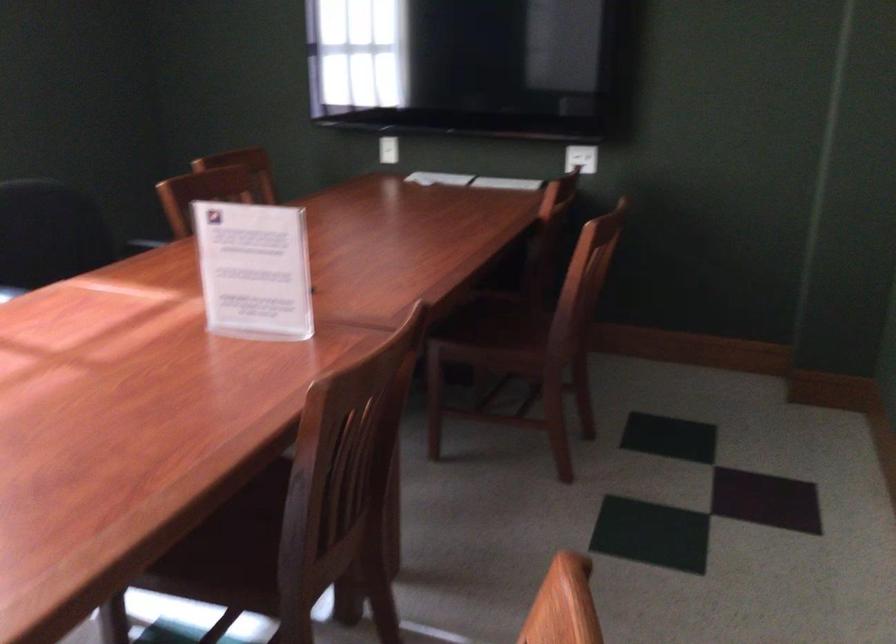
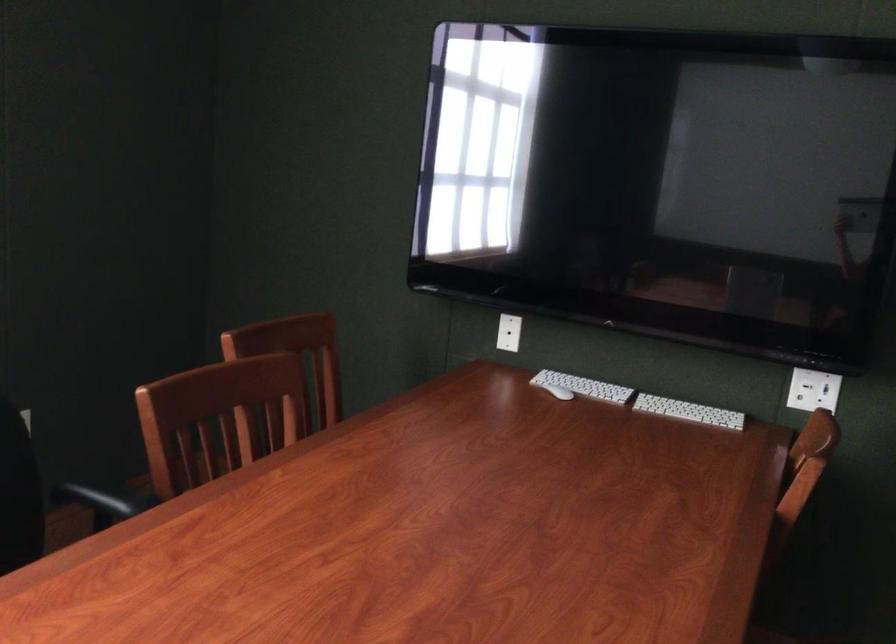
In the second image, find the point that corresponds to pixel 424 178 in the first image.

(558, 392)